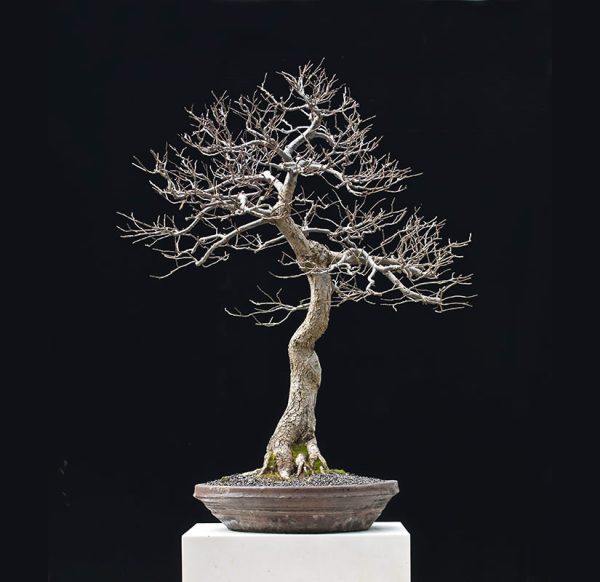
This screenshot has height=582, width=600. Find the location of `white pedestal`. white pedestal is located at coordinates (384, 527).